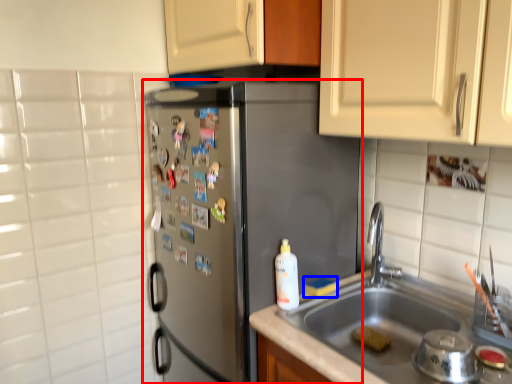
Question: Among these objects, which one is farthest to the camera, refrigerator (highlighted by a red box) or food (highlighted by a blue box)?

Choices:
 (A) refrigerator
 (B) food

Answer: (B)